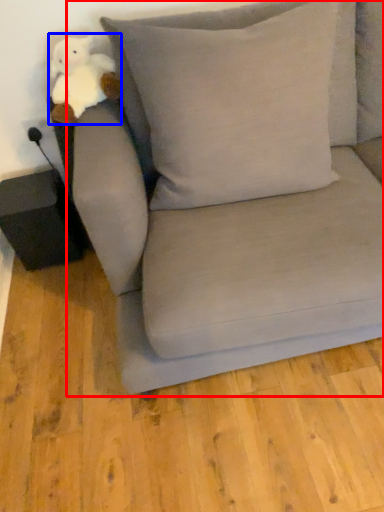
Question: Which object appears closest to the camera in this image, studio couch (highlighted by a red box) or toy (highlighted by a blue box)?

Choices:
 (A) studio couch
 (B) toy

Answer: (A)